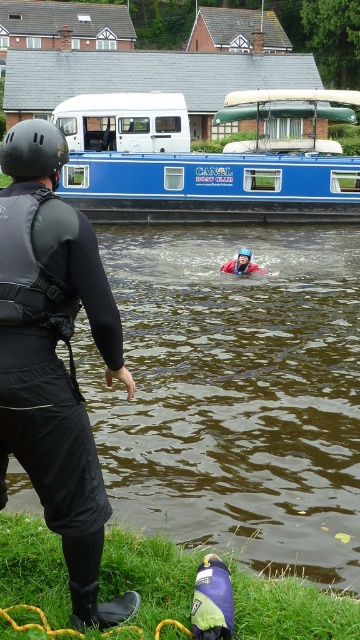
You are a photographer standing at the camera position. You want to take a photo of the point at coordinate point (74, 448). The camera has a minimum focus distance of 3 meters. Can you focus on that point without moving?

The point at coordinate point (74, 448) is 3.56 meters away from the camera, so yes, the camera can focus on that point since it is beyond the minimum focus distance of 3 meters.

You are a lifeguard on duty and need to reach the two points marked in the image. The first point is point [25,355] and the second point is point [249,253]. Based on their positions, which point is closer to the lifeguard station located at the edge of the canal bank?

Point [25,355] is in front of point [249,253], so the first point is closer to the lifeguard station at the edge of the canal bank.